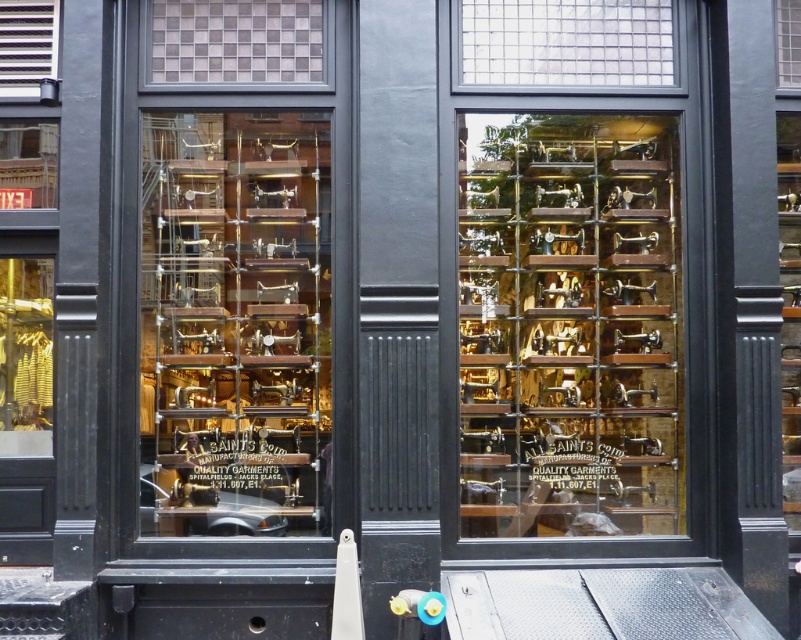
Is point (25, 3) positioned behind point (787, 13)?

No, it is in front of (787, 13).

Is the position of metallic vent at upper left less distant than that of clear glass window at upper right?

Yes, it is in front of clear glass window at upper right.

Is point (38, 67) closer to camera compared to point (787, 61)?

Yes, it is in front of point (787, 61).

Where is `metallic vent at upper left`? metallic vent at upper left is located at coordinates (27, 45).

Who is more distant from viewer, [252,68] or [49,168]?

Positioned behind is point [252,68].

Is checkered glass at upper center in front of red digital sign at upper left?

No, checkered glass at upper center is behind red digital sign at upper left.

Is point (256, 20) positioned behind point (26, 182)?

Yes, it is.

The image size is (801, 640). In order to click on checkered glass at upper center in this screenshot , I will do `click(236, 40)`.

Can you confirm if gold metallic sewing machines at center is wider than metallic vent at upper left?

Yes, gold metallic sewing machines at center is wider than metallic vent at upper left.

Between gold metallic sewing machines at center and metallic vent at upper left, which one has more height?

gold metallic sewing machines at center

Where is `gold metallic sewing machines at center`? gold metallic sewing machines at center is located at coordinates (570, 324).